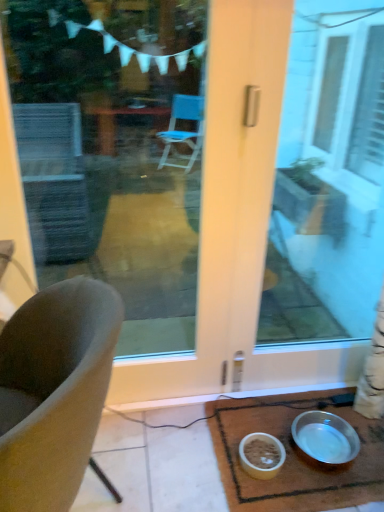
What are the coordinates of `vacant space positioned to the left of silver metallic bowl at lower right, the 2th bowl in the left-to-right sequence` in the screenshot? It's located at (263, 434).